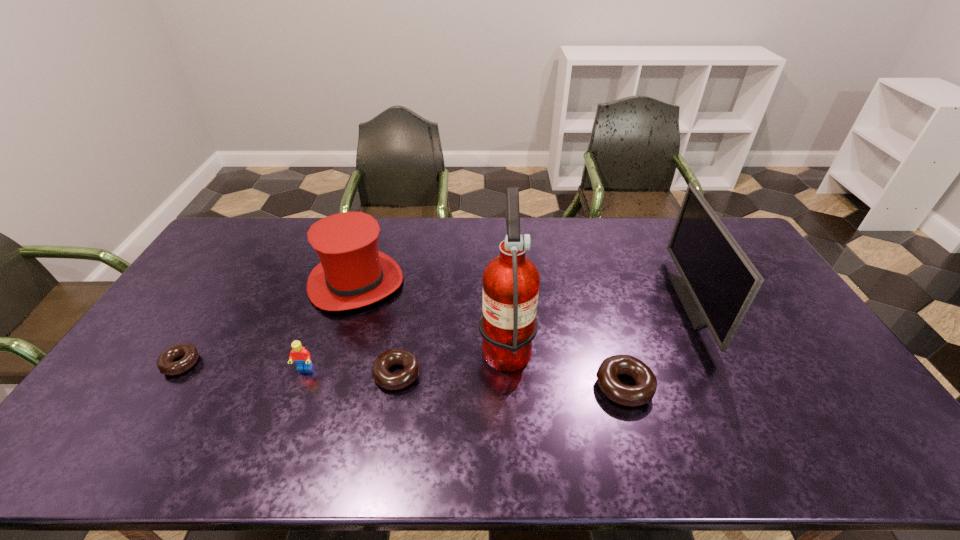
Please point a spot to add another doughnut on the right. Please provide its 2D coordinates. Your answer should be formatted as a tuple, i.e. [(x, y)], where the tuple contains the x and y coordinates of a point satisfying the conditions above.

[(862, 399)]